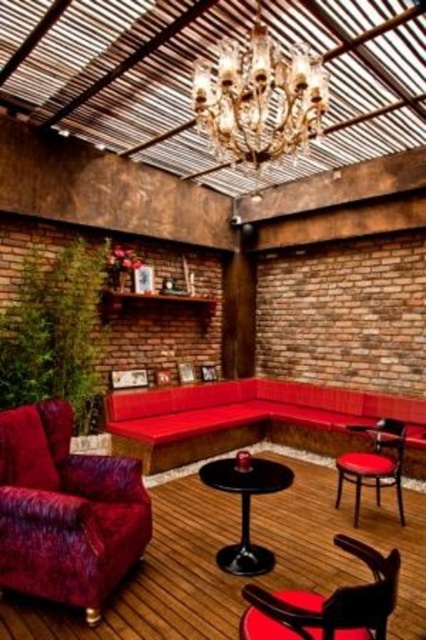
You are a GUI agent. You are given a task and a screenshot of the screen. Output one action in this format:
    pyautogui.click(x=<x>, y=<y>)
    Task: Click on the velvet red couch at center
    The image size is (426, 640).
    Given the screenshot: What is the action you would take?
    pyautogui.click(x=253, y=420)

Who is more forward, (417, 408) or (222, 490)?

Point (222, 490) is more forward.

This screenshot has height=640, width=426. Identify the location of velvet red couch at center. (253, 420).

Can you confirm if velvet red couch at center is positioned to the right of matte black armchair at lower right?

Incorrect, velvet red couch at center is not on the right side of matte black armchair at lower right.

Can you confirm if velvet red couch at center is bigger than matte black armchair at lower right?

Indeed, velvet red couch at center has a larger size compared to matte black armchair at lower right.

Where is `velvet red couch at center`? The width and height of the screenshot is (426, 640). velvet red couch at center is located at coordinates (253, 420).

Does crystal glass chandelier at upper center appear on the left side of matte black armchair at lower right?

Yes, crystal glass chandelier at upper center is to the left of matte black armchair at lower right.

Is point (310, 109) farther from camera compared to point (389, 432)?

No, it is not.

Where is `crystal glass chandelier at upper center`? This screenshot has height=640, width=426. crystal glass chandelier at upper center is located at coordinates (259, 100).